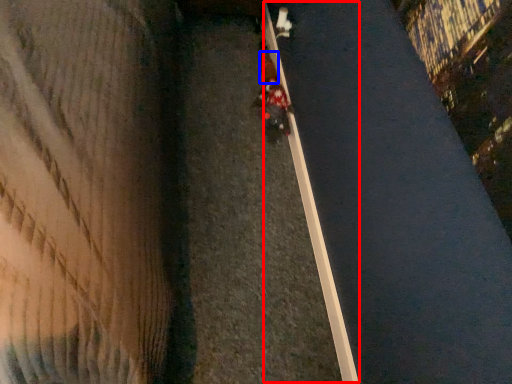
Question: Which object is closer to the camera taking this photo, curb (highlighted by a red box) or pedestrian (highlighted by a blue box)?

Choices:
 (A) curb
 (B) pedestrian

Answer: (A)